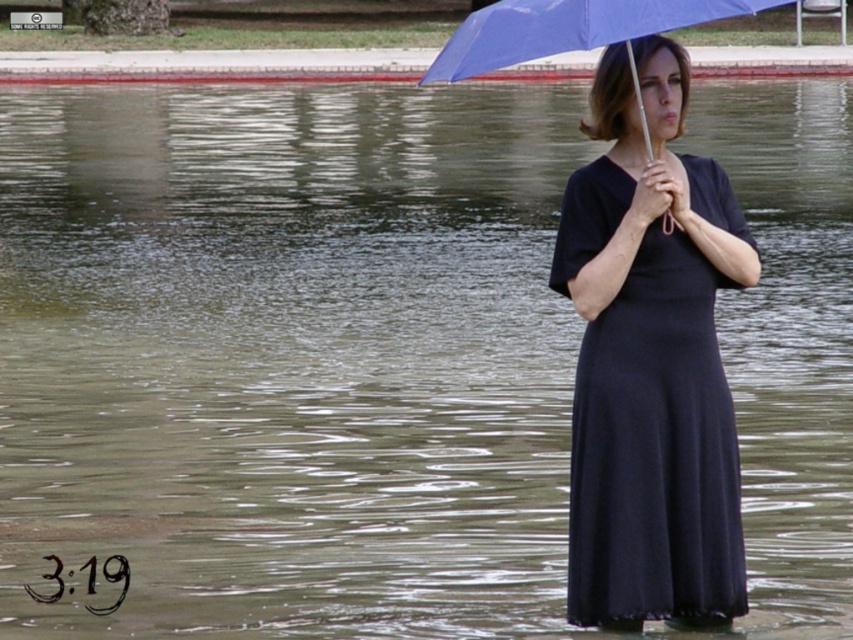
Is black matte dress at center behind blue matte umbrella at upper center?

Yes.

Is point (651, 428) positioned behind point (670, 19)?

Yes.

At what (x,y) coordinates should I click in order to perform the action: click on black matte dress at center. Please return your answer as a coordinate pair (x, y). The height and width of the screenshot is (640, 853). Looking at the image, I should click on (654, 449).